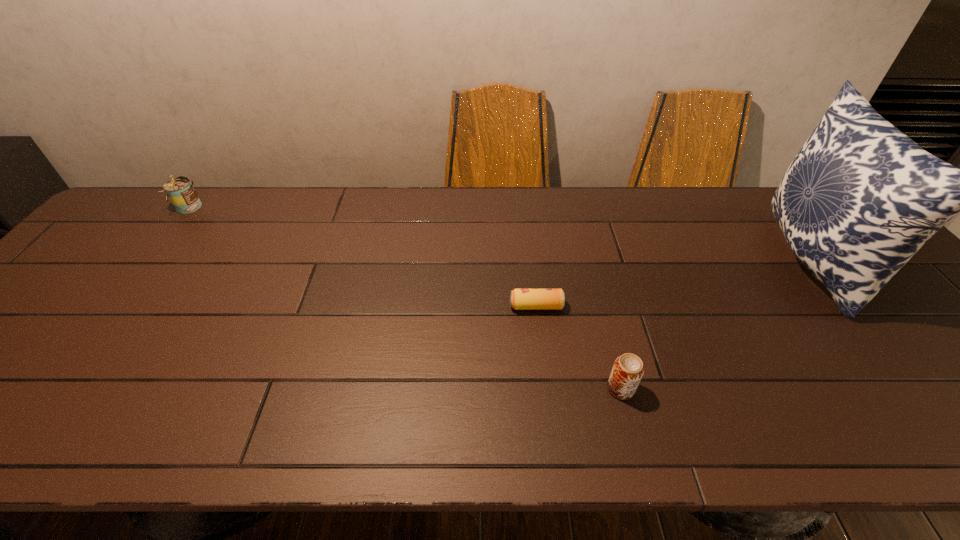
Locate an element on the screen. Image resolution: width=960 pixels, height=540 pixels. vacant area at the far edge is located at coordinates (474, 218).

Locate an element on the screen. Image resolution: width=960 pixels, height=540 pixels. vacant position at the left edge of the desktop is located at coordinates (85, 304).

Image resolution: width=960 pixels, height=540 pixels. Find the location of `free space at the right edge`. free space at the right edge is located at coordinates (926, 326).

Where is `free space between the second object from right to left and the cushion`? The height and width of the screenshot is (540, 960). free space between the second object from right to left and the cushion is located at coordinates (715, 325).

You are a GUI agent. You are given a task and a screenshot of the screen. Output one action in this format:
    pyautogui.click(x=<x>, y=<y>)
    Task: Click on the free spot between the leftmost object and the taller beer can
    
    Given the screenshot: What is the action you would take?
    pyautogui.click(x=405, y=298)

Find the location of a particular element. This screenshot has width=960, height=540. vacant region between the tallest object and the second object from left to right is located at coordinates (673, 284).

Locate an element on the screen. This screenshot has width=960, height=540. unoccupied position between the rightmost object and the shortest object is located at coordinates tap(673, 284).

Image resolution: width=960 pixels, height=540 pixels. Find the location of `vacant region between the shorter beer can and the second shortest object`. vacant region between the shorter beer can and the second shortest object is located at coordinates (579, 347).

Identify the location of empty space that is in between the second object from right to left and the second tallest object. The image size is (960, 540). (405, 298).

Where is `unoccupied area between the cushion and the third shortest object`? unoccupied area between the cushion and the third shortest object is located at coordinates (499, 234).